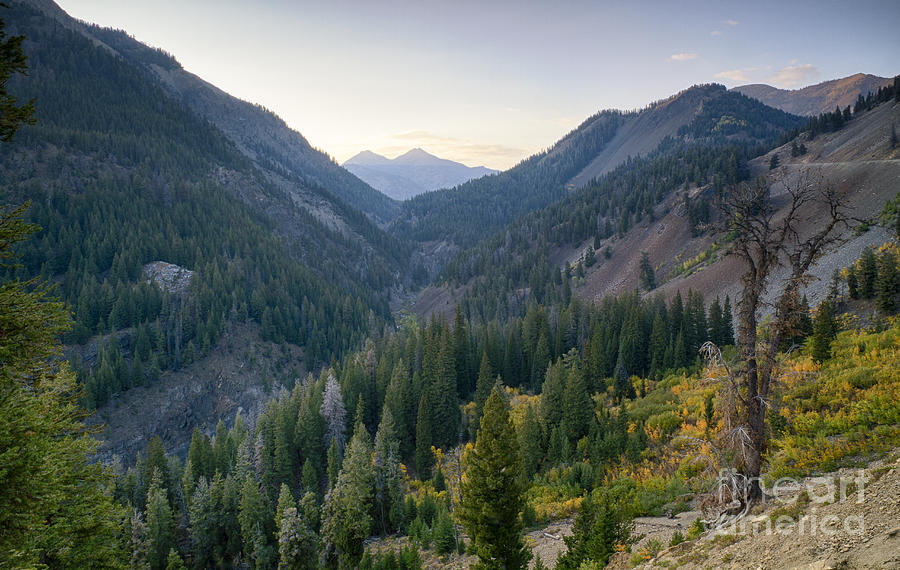
Identify the location of ledge. (855, 162).